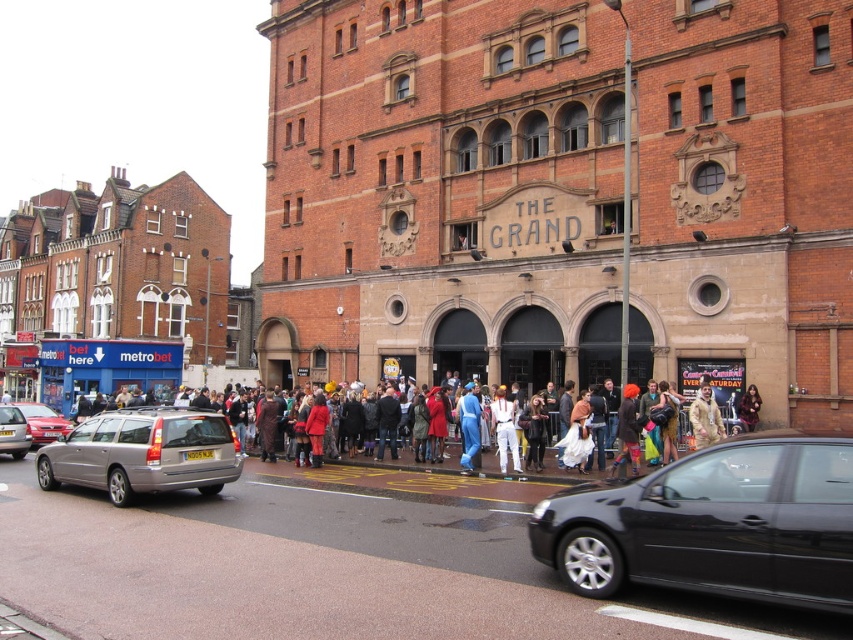
You are a delivery person who needs to park your van between the silver metallic estate car at left and the silver metallic hatchback at left. Your van is 5 meters long. Is there enough space between them?

The distance between the silver metallic estate car at left and the silver metallic hatchback at left is 15.45 meters. Since your van is only 5 meters long, there is sufficient space to park between them.